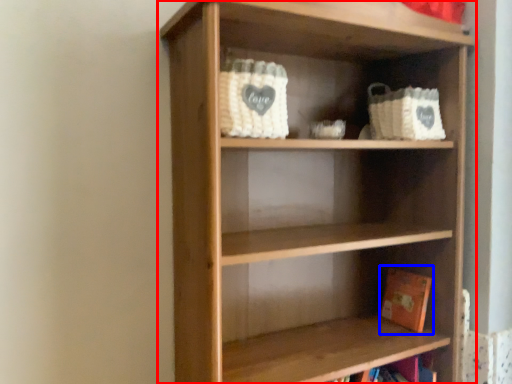
Question: Which of the following is the closest to the observer, shelf (highlighted by a red box) or book (highlighted by a blue box)?

Choices:
 (A) shelf
 (B) book

Answer: (A)